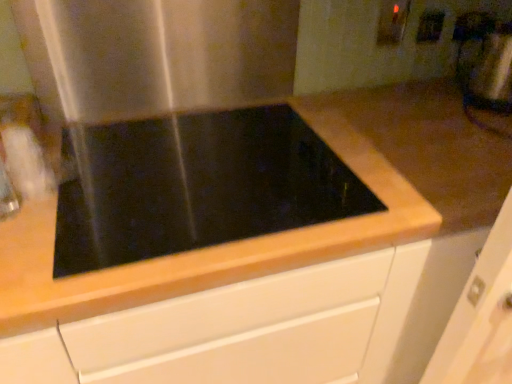
Identify the location of vacant space to the left of metallic silver blender at upper right. Image resolution: width=512 pixels, height=384 pixels. (436, 98).